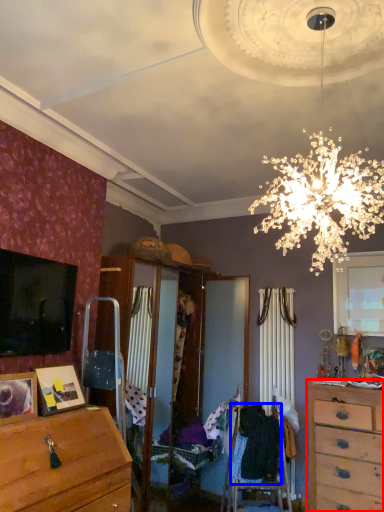
Question: Which point is further to the camera, chest of drawers (highlighted by a red box) or clothing (highlighted by a blue box)?

Choices:
 (A) chest of drawers
 (B) clothing

Answer: (B)